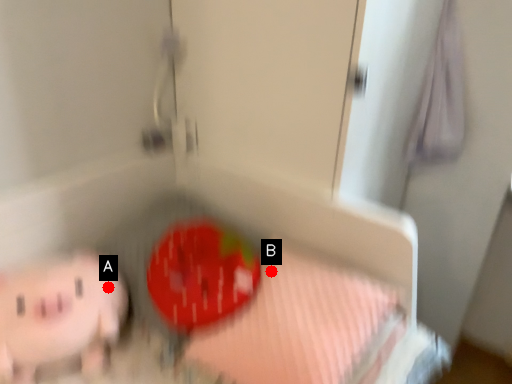
Question: Two points are circled on the image, labeled by A and B beside each circle. Which point is closer to the camera?

Choices:
 (A) A is closer
 (B) B is closer

Answer: (A)